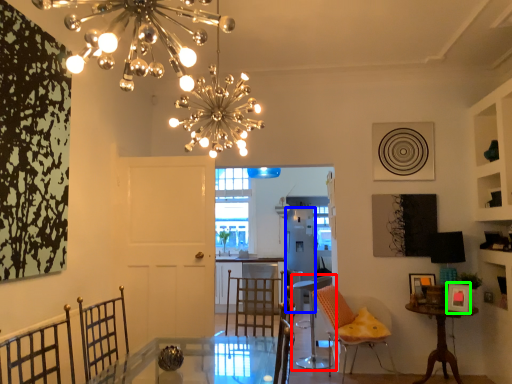
Question: Based on their relative distances, which object is nearer to chair (highlighted by a red box)? Choose from appliance (highlighted by a blue box) and picture frame (highlighted by a green box).

Choices:
 (A) appliance
 (B) picture frame

Answer: (A)